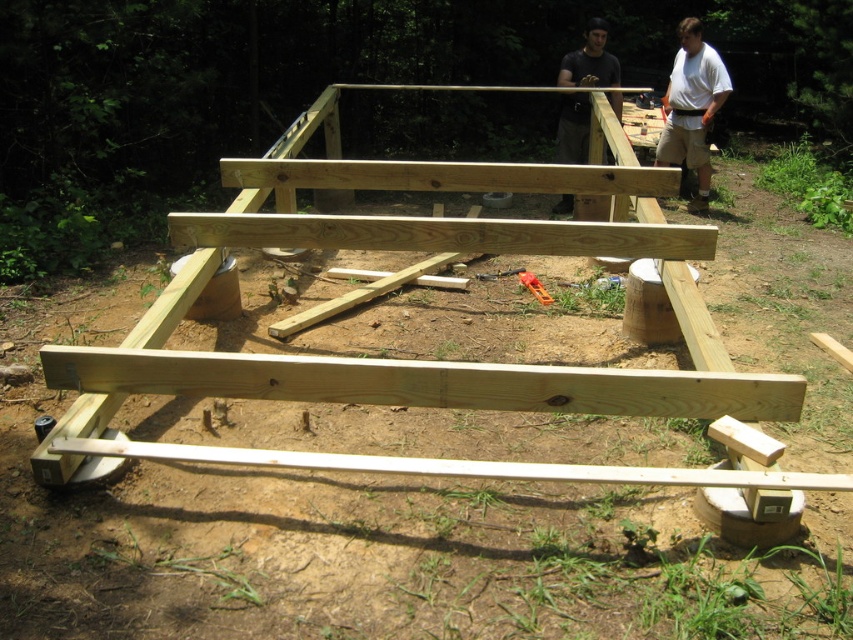
Question: Can you confirm if natural wood frame at center is thinner than metallic orange wrench at center?

Choices:
 (A) yes
 (B) no

Answer: (B)

Question: Does natural wood frame at center appear on the left side of dark gray shirt at upper center?

Choices:
 (A) yes
 (B) no

Answer: (A)

Question: Which point is farther from the camera taking this photo?

Choices:
 (A) (686, 29)
 (B) (74, 444)

Answer: (A)

Question: Which point is closer to the camera?

Choices:
 (A) white cotton shirt at upper right
 (B) natural wood frame at center

Answer: (B)

Question: Which point is closer to the camera?

Choices:
 (A) metallic orange wrench at center
 (B) natural wood frame at center

Answer: (B)

Question: Observing the image, what is the correct spatial positioning of natural wood frame at center in reference to white cotton shirt at upper right?

Choices:
 (A) left
 (B) right

Answer: (A)